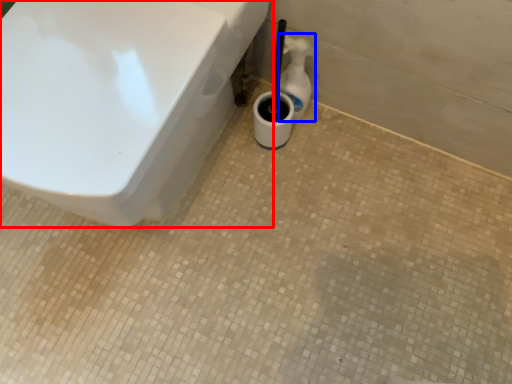
Question: Which of the following is the closest to the observer, toilet (highlighted by a red box) or bottle (highlighted by a blue box)?

Choices:
 (A) toilet
 (B) bottle

Answer: (A)